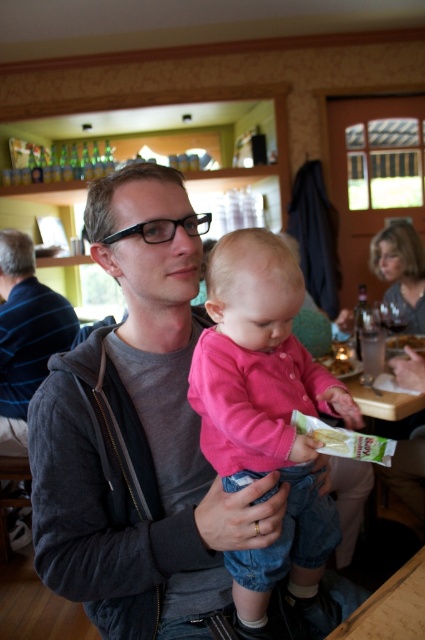
You are a person standing at the center of the room. You want to reach both the gray matte jacket at center and the green matte snack packet at center. Which one is closer to you?

Both the gray matte jacket at center and the green matte snack packet at center are at the same distance from you since they are both at the center of the room.

In the scene shown: You are a fashion designer observing the scene and want to create a new line of baby clothing. Given the pink matte sweater at center and the gray matte jacket at center, which one should you prioritize in terms of length to ensure it aligns with the current style preferences shown in the image?

The pink matte sweater at center is shorter than the gray matte jacket at center, so prioritizing the shorter length of the pink matte sweater at center would align with the style preferences shown in the image.

You are a photographer trying to capture the baby in the pink matte sweater at center and the man in the gray matte jacket at center. Based on their positions, which clothing item is closer to the camera?

The pink matte sweater at center is located below the gray matte jacket at center, meaning the gray matte jacket at center is closer to the camera.